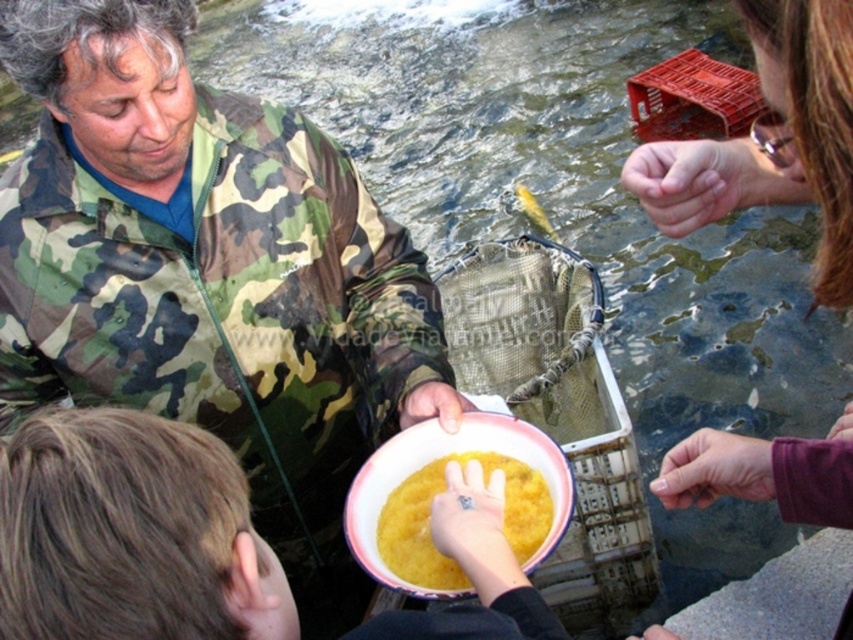
Does yellow matte food at center have a greater width compared to yellow shiny fish at center?

Yes.

Does point (500, 461) come in front of point (521, 189)?

Yes, point (500, 461) is closer to viewer.

Does point (444, 573) come in front of point (521, 188)?

That is True.

This screenshot has height=640, width=853. In order to click on yellow matte food at center in this screenshot , I will do (430, 513).

Looking at this image, how distant is camouflage jacket at center from yellow shiny fish at center?

They are 3.82 meters apart.

Find the location of a particular element. This screenshot has height=640, width=853. camouflage jacket at center is located at coordinates (206, 266).

Between matte green camouflage jacket at center and yellow shiny fish at center, which one has more height?

Standing taller between the two is yellow shiny fish at center.

Does point (44, 616) lie in front of point (531, 212)?

Yes, point (44, 616) is in front of point (531, 212).

I want to click on matte green camouflage jacket at center, so click(x=131, y=534).